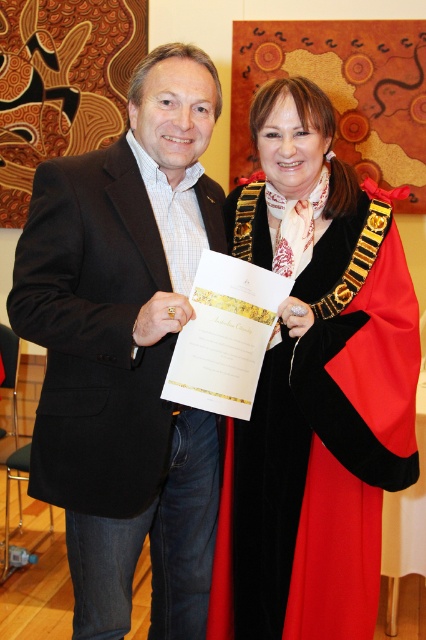
Who is higher up, black matte suit at center or velvet black coat at center?

velvet black coat at center is above.

At what (x,y) coordinates should I click in order to perform the action: click on black matte suit at center. Please return your answer as a coordinate pair (x, y). The image size is (426, 640). Looking at the image, I should click on (126, 349).